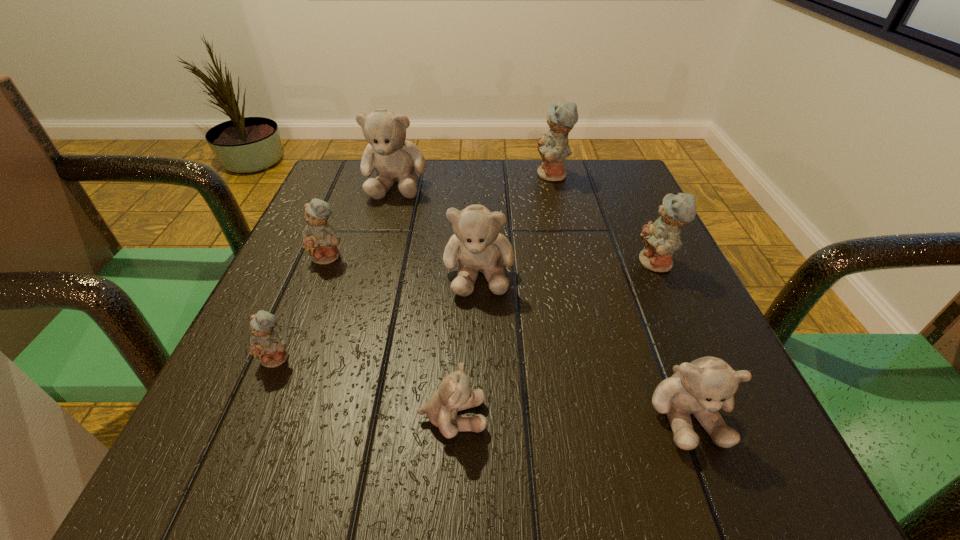
I want to click on free space at the far right corner, so click(617, 170).

Identify the location of empty space that is in between the farthest blue teddy bear and the second biggest blue teddy bear. The image size is (960, 540). (604, 220).

Locate an element on the screen. The height and width of the screenshot is (540, 960). vacant space that is in between the third blue teddy bear from left to right and the third biggest blue teddy bear is located at coordinates (441, 216).

Locate an element on the screen. The width and height of the screenshot is (960, 540). free space between the third biggest blue teddy bear and the second farthest gray teddy bear is located at coordinates (403, 265).

Where is `unoccupied position between the third object from right to left and the second smallest blue teddy bear`? This screenshot has height=540, width=960. unoccupied position between the third object from right to left and the second smallest blue teddy bear is located at coordinates (441, 216).

Find the location of `vacant region between the rightmost blue teddy bear and the second farthest gray teddy bear`. vacant region between the rightmost blue teddy bear and the second farthest gray teddy bear is located at coordinates (567, 268).

At what (x,y) coordinates should I click in order to perform the action: click on vacant area that lies between the smallest gray teddy bear and the third blue teddy bear from left to right. Please return your answer as a coordinate pair (x, y). Looking at the image, I should click on (502, 296).

Locate an element on the screen. vacant area that lies between the second blue teddy bear from right to left and the second biggest gray teddy bear is located at coordinates (516, 225).

Where is `free space between the second farthest gray teddy bear and the rightmost gray teddy bear`? free space between the second farthest gray teddy bear and the rightmost gray teddy bear is located at coordinates (583, 343).

The width and height of the screenshot is (960, 540). I want to click on free spot between the sixth object from left to right and the rightmost blue teddy bear, so click(x=604, y=220).